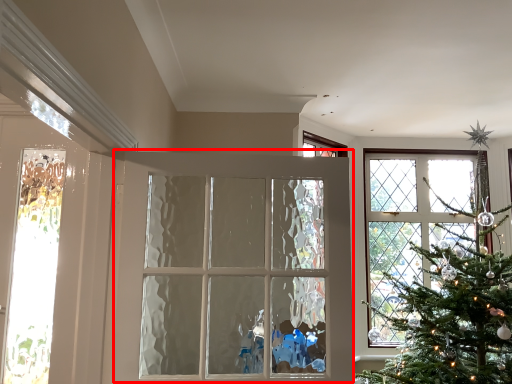
Question: Observing the image, what is the correct spatial positioning of door (annotated by the red box) in reference to door?

Choices:
 (A) right
 (B) left

Answer: (A)